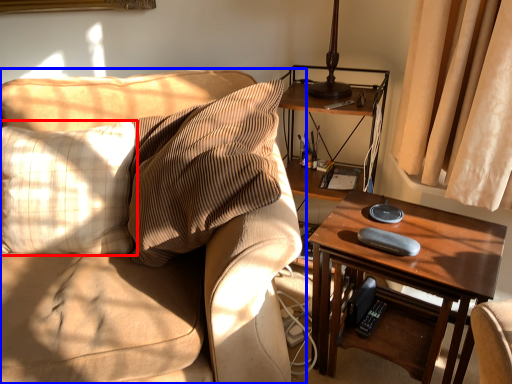
Question: Which point is further to the camera, pillow (highlighted by a red box) or studio couch (highlighted by a blue box)?

Choices:
 (A) pillow
 (B) studio couch

Answer: (A)